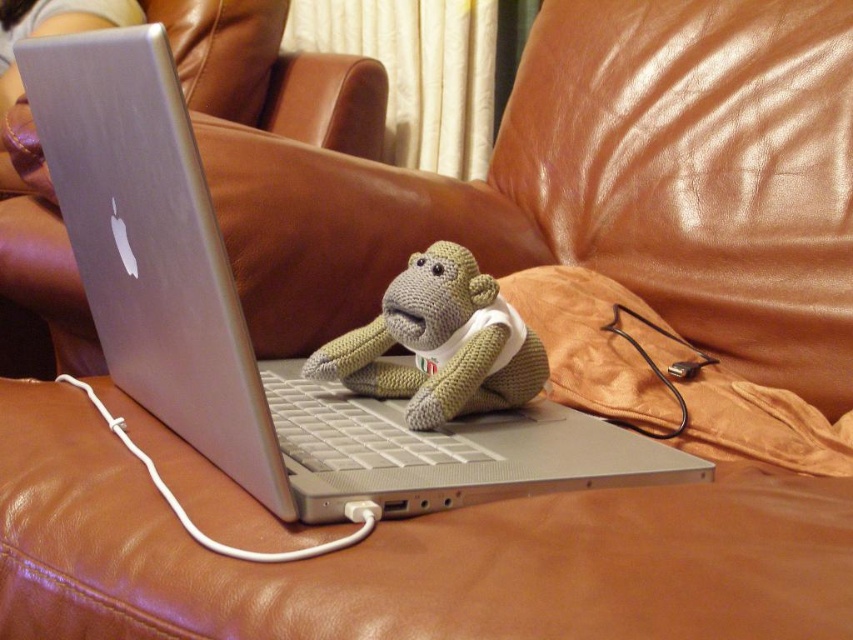
Who is lower down, silver metallic laptop at center or knitted beige monkey at center?

Positioned lower is silver metallic laptop at center.

Who is taller, silver metallic laptop at center or knitted beige monkey at center?

silver metallic laptop at center is taller.

Measure the distance between point (x=83, y=268) and camera.

Point (x=83, y=268) is 24.23 inches from camera.

You are a GUI agent. You are given a task and a screenshot of the screen. Output one action in this format:
    pyautogui.click(x=<x>, y=<y>)
    Task: Click on the silver metallic laptop at center
    
    Given the screenshot: What is the action you would take?
    pyautogui.click(x=245, y=323)